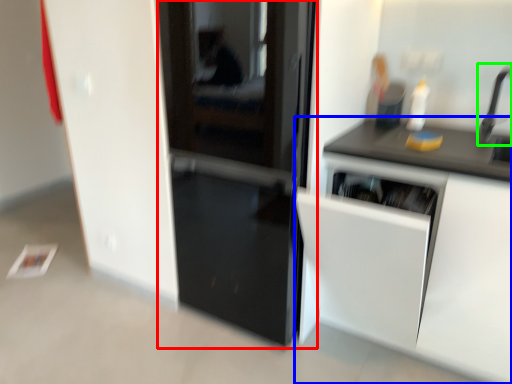
Question: Considering the real-world distances, which object is closest to door (highlighted by a red box)? cabinetry (highlighted by a blue box) or faucet (highlighted by a green box).

Choices:
 (A) cabinetry
 (B) faucet

Answer: (A)